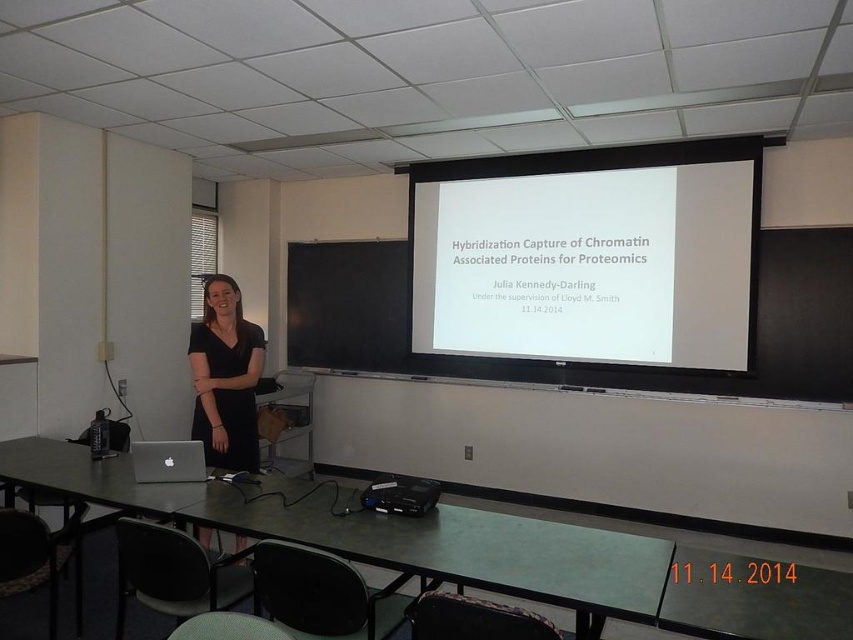
Is point (722, 140) positioned after point (416, 506)?

Yes, point (722, 140) is behind point (416, 506).

Which is in front, point (461, 241) or point (422, 499)?

Point (422, 499) is more forward.

Identify the location of white matte projection screen at upper center. (589, 253).

I want to click on white matte projection screen at upper center, so [x=589, y=253].

Is black matte dress at center further to the viewer compared to black plastic projector at center?

Yes.

Can you confirm if black matte dress at center is positioned to the left of black plastic projector at center?

Correct, you'll find black matte dress at center to the left of black plastic projector at center.

What are the coordinates of `black matte dress at center` in the screenshot? It's located at (225, 378).

Describe the element at coordinates (225, 378) in the screenshot. I see `black matte dress at center` at that location.

In order to click on black matte dress at center in this screenshot , I will do `click(225, 378)`.